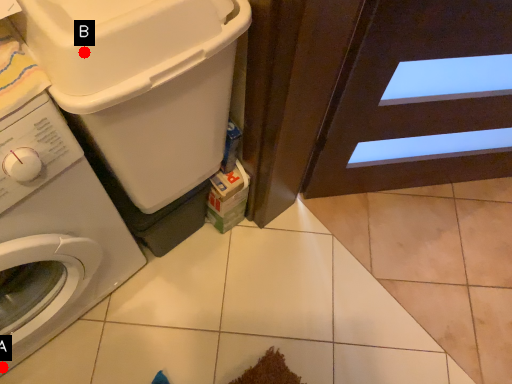
Question: Two points are circled on the image, labeled by A and B beside each circle. Which point is farther to the camera?

Choices:
 (A) A is further
 (B) B is further

Answer: (A)